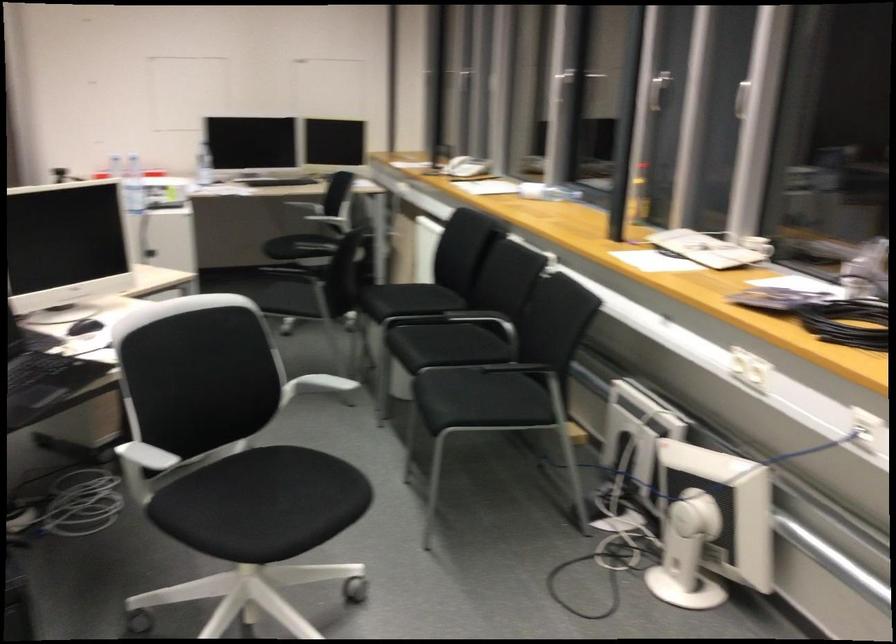
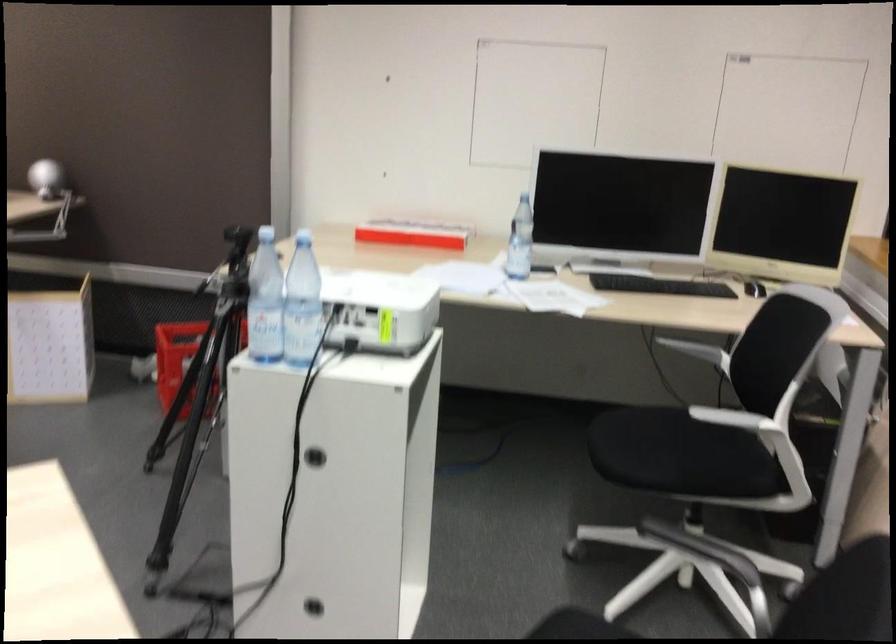
Find the pixel in the second image that matches point (150, 252) in the first image.

(314, 456)